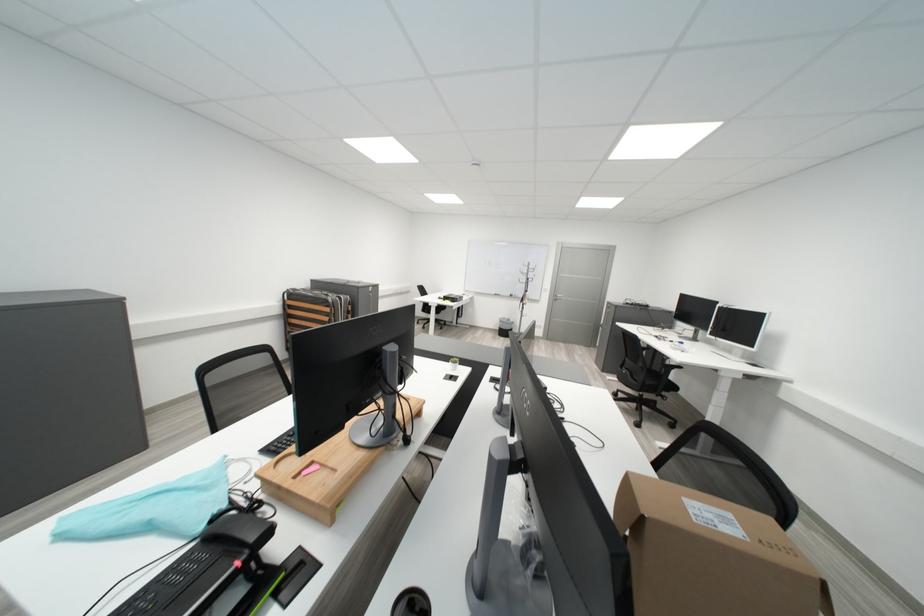
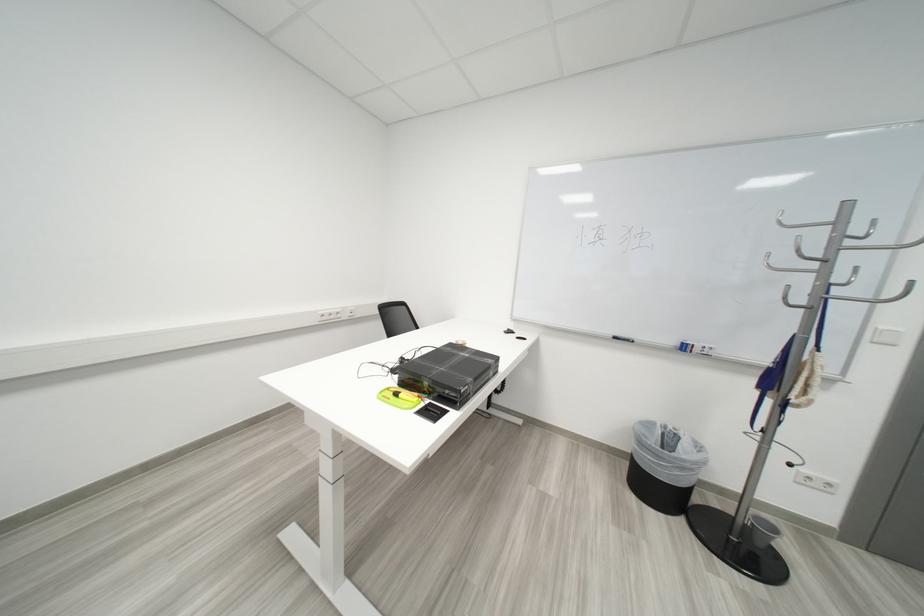
The point at (525, 297) is marked in the first image. Where is the corresponding point in the second image?

(698, 350)